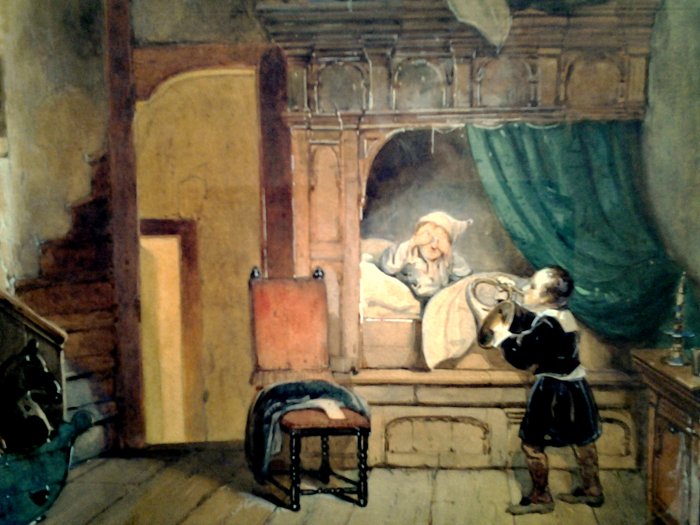
Find the location of `floor planks`. floor planks is located at coordinates (183, 495).